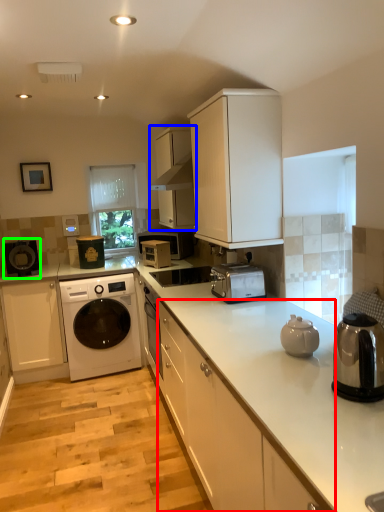
Question: Which object is positioned farthest from cabinetry (highlighted by a red box)? Select from cabinetry (highlighted by a blue box) and appliance (highlighted by a green box).

Choices:
 (A) cabinetry
 (B) appliance

Answer: (B)